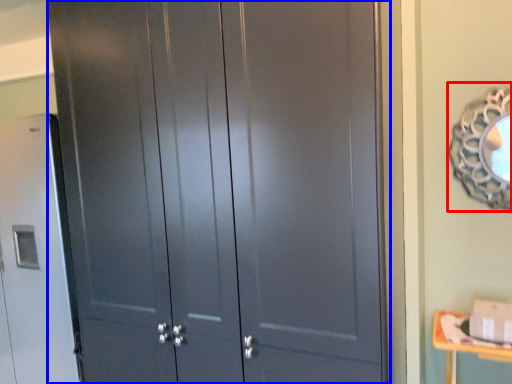
Question: Which of the following is the farthest to the observer, mirror (highlighted by a red box) or door (highlighted by a blue box)?

Choices:
 (A) mirror
 (B) door

Answer: (A)